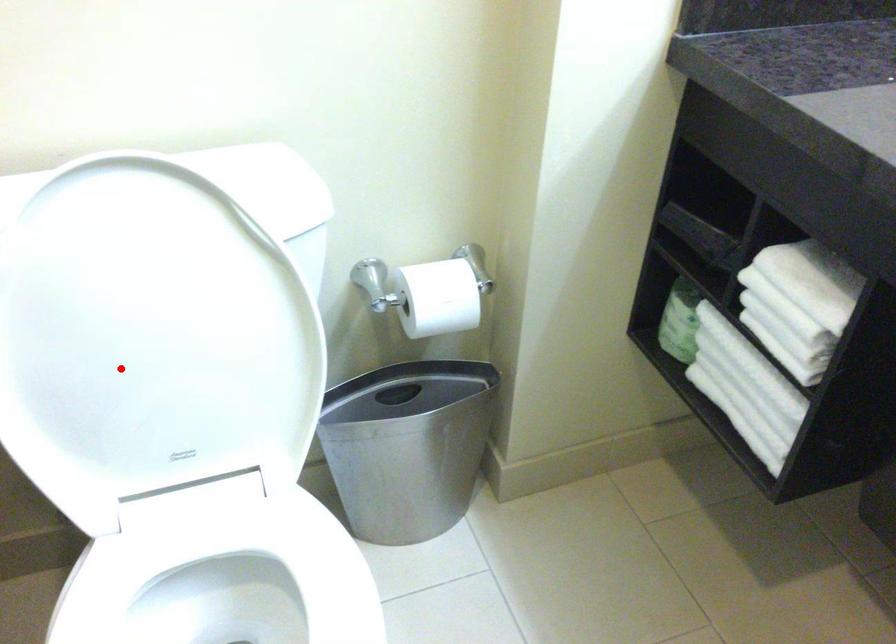
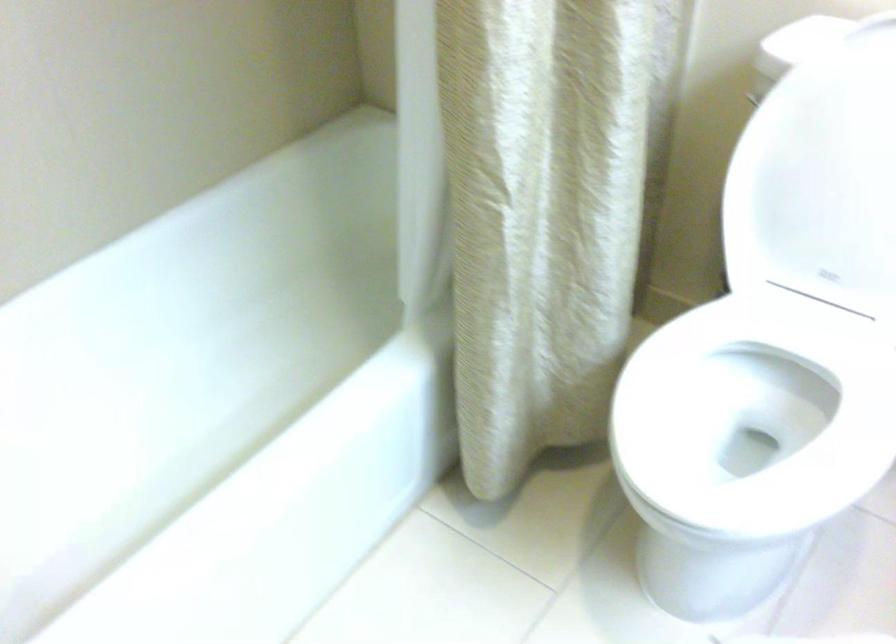
The point at the highlighted location is marked in the first image. Where is the corresponding point in the second image?

(821, 178)